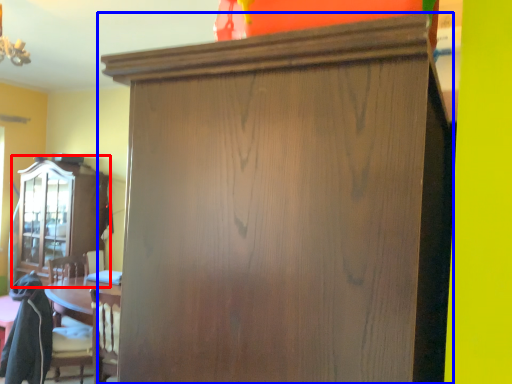
Question: Which of the following is the farthest to the observer, cabinetry (highlighted by a red box) or cupboard (highlighted by a blue box)?

Choices:
 (A) cabinetry
 (B) cupboard

Answer: (A)